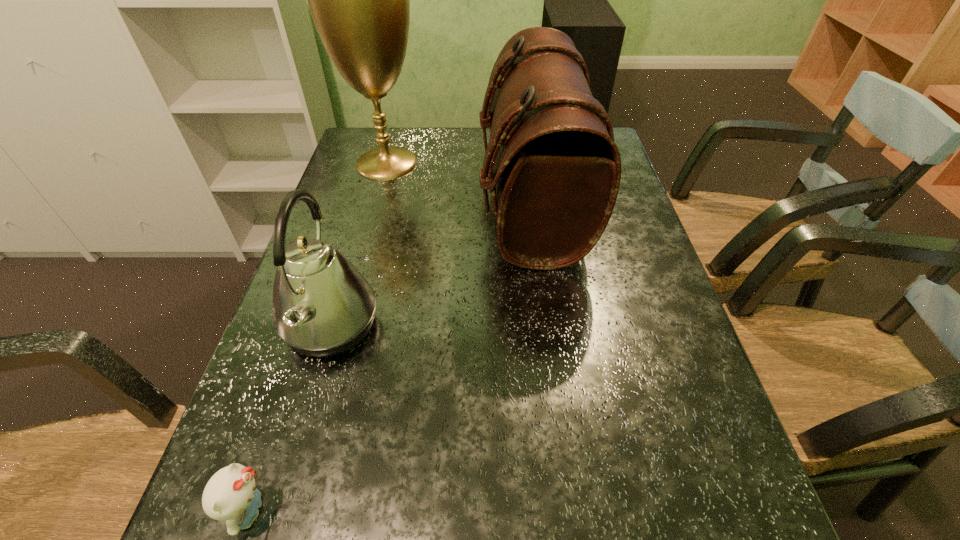
You are a GUI agent. You are given a task and a screenshot of the screen. Output one action in this format:
    pyautogui.click(x=<x>, y=<y>)
    Task: Click on the trophy cup positioned at the far edge
    
    Given the screenshot: What is the action you would take?
    pyautogui.click(x=359, y=0)

At what (x,y) coordinates should I click in order to perform the action: click on satchel that is positioned at the far edge. Please return your answer as a coordinate pair (x, y). Image resolution: width=960 pixels, height=540 pixels. Looking at the image, I should click on (557, 170).

Find the location of a particular element. trophy cup situated at the left edge is located at coordinates (359, 0).

You are a GUI agent. You are given a task and a screenshot of the screen. Output one action in this format:
    pyautogui.click(x=<x>, y=<y>)
    Task: Click on the kettle present at the left edge
    This screenshot has width=960, height=540.
    Given the screenshot: What is the action you would take?
    pyautogui.click(x=322, y=306)

Identify the location of object that is at the right edge. This screenshot has height=540, width=960. (557, 170).

Identify the location of object present at the far left corner. (359, 0).

Image resolution: width=960 pixels, height=540 pixels. I want to click on object positioned at the far right corner, so click(x=557, y=170).

The width and height of the screenshot is (960, 540). I want to click on free spot at the far edge of the desktop, so click(410, 140).

I want to click on vacant region at the left edge of the desktop, so click(336, 191).

In the image, there is a desktop. In order to click on free space at the right edge in this screenshot , I will do `click(663, 448)`.